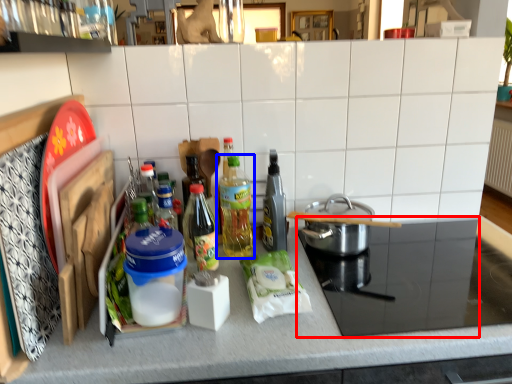
Question: Which point is closer to the camera, appliance (highlighted by a red box) or bottle (highlighted by a blue box)?

Choices:
 (A) appliance
 (B) bottle

Answer: (A)